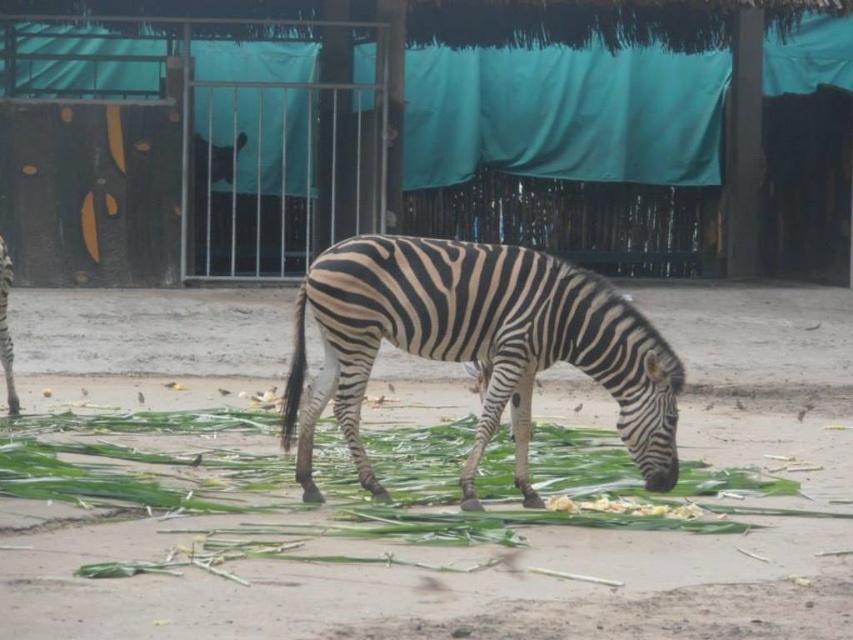
Does green leafy grass at center have a greater width compared to black and white striped zebra at center?

Yes.

Does point (82, 480) come in front of point (444, 342)?

No.

This screenshot has height=640, width=853. Describe the element at coordinates (532, 483) in the screenshot. I see `green leafy grass at center` at that location.

The image size is (853, 640). What are the coordinates of `green leafy grass at center` in the screenshot? It's located at 532,483.

Consider the image. Is black and white striped zebra at center behind yellow crumbly food at lower center?

No, it is not.

Can you confirm if black and white striped zebra at center is positioned below yellow crumbly food at lower center?

No.

Identify the location of black and white striped zebra at center. [x=477, y=344].

Between green leafy grass at center and yellow crumbly food at lower center, which one is positioned lower?

Positioned lower is yellow crumbly food at lower center.

Based on the photo, does green leafy grass at center have a greater height compared to yellow crumbly food at lower center?

Yes, green leafy grass at center is taller than yellow crumbly food at lower center.

Is point (287, 548) closer to camera compared to point (619, 504)?

Yes, point (287, 548) is in front of point (619, 504).

I want to click on green leafy grass at center, so coord(532,483).